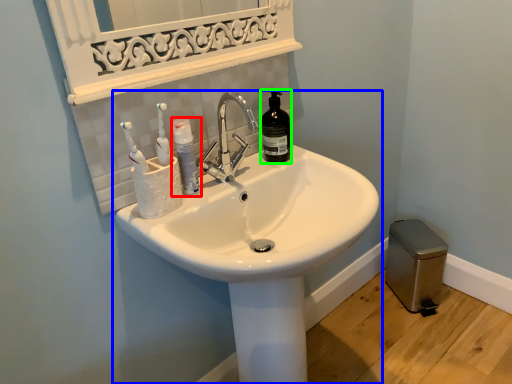
Question: Based on their relative distances, which object is farther from mouthwash (highlighted by a red box)? Choose from sink (highlighted by a blue box) and bottle (highlighted by a green box).

Choices:
 (A) sink
 (B) bottle

Answer: (A)